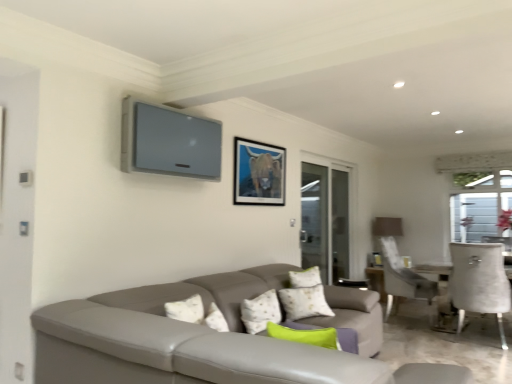
Question: From a real-world perspective, is transparent glass screen door at right under matte black picture frame at upper center?

Choices:
 (A) no
 (B) yes

Answer: (B)

Question: Is matte black picture frame at upper center at the back of transparent glass screen door at right?

Choices:
 (A) yes
 (B) no

Answer: (B)

Question: Is transparent glass screen door at right bigger than matte black picture frame at upper center?

Choices:
 (A) no
 (B) yes

Answer: (B)

Question: From the image's perspective, is transparent glass screen door at right below matte black picture frame at upper center?

Choices:
 (A) yes
 (B) no

Answer: (A)

Question: Is transparent glass screen door at right in front of matte black picture frame at upper center?

Choices:
 (A) no
 (B) yes

Answer: (A)

Question: Is matte black picture frame at upper center in front of or behind green fabric pillow at center in the image?

Choices:
 (A) behind
 (B) front

Answer: (A)

Question: Is point (253, 175) closer or farther from the camera than point (259, 294)?

Choices:
 (A) farther
 (B) closer

Answer: (A)

Question: Which is correct: matte black picture frame at upper center is inside green fabric pillow at center, or outside of it?

Choices:
 (A) inside
 (B) outside

Answer: (B)

Question: Visually, is matte black picture frame at upper center positioned to the left or to the right of green fabric pillow at center?

Choices:
 (A) left
 (B) right

Answer: (B)

Question: Relative to matte black picture frame at upper center, is green fabric pillow at center in front or behind?

Choices:
 (A) behind
 (B) front

Answer: (B)

Question: Is point (262, 306) closer or farther from the camera than point (240, 175)?

Choices:
 (A) farther
 (B) closer

Answer: (B)

Question: From a real-world perspective, relative to matte black picture frame at upper center, is green fabric pillow at center vertically above or below?

Choices:
 (A) below
 (B) above

Answer: (A)

Question: In terms of width, does green fabric pillow at center look wider or thinner when compared to matte black picture frame at upper center?

Choices:
 (A) thin
 (B) wide

Answer: (B)

Question: From the image's perspective, relative to green fabric pillow at center, is transparent glass screen door at right above or below?

Choices:
 (A) above
 (B) below

Answer: (A)

Question: Considering the positions of transparent glass screen door at right and green fabric pillow at center in the image, is transparent glass screen door at right taller or shorter than green fabric pillow at center?

Choices:
 (A) short
 (B) tall

Answer: (B)